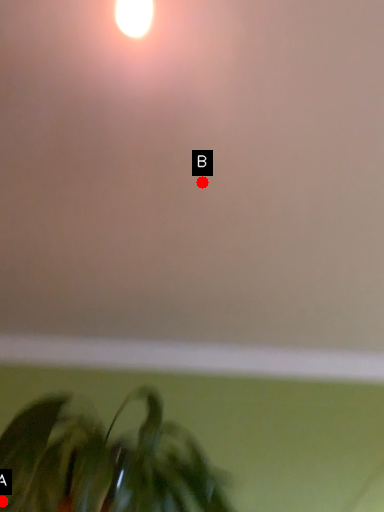
Question: Two points are circled on the image, labeled by A and B beside each circle. Which of the following is the closest to the observer?

Choices:
 (A) A is closer
 (B) B is closer

Answer: (A)